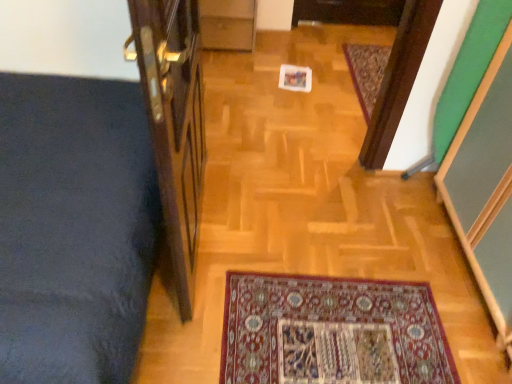
Question: From a real-world perspective, is carpeted mat at center positioned above or below wooden door at left?

Choices:
 (A) below
 (B) above

Answer: (A)

Question: From their relative heights in the image, would you say carpeted mat at center is taller or shorter than wooden door at left?

Choices:
 (A) short
 (B) tall

Answer: (A)

Question: Would you say carpeted mat at center is inside or outside wooden door at left?

Choices:
 (A) outside
 (B) inside

Answer: (A)

Question: Is wooden door at left wider or thinner than carpeted mat at center?

Choices:
 (A) thin
 (B) wide

Answer: (A)

Question: Would you say wooden door at left is inside or outside carpeted mat at center?

Choices:
 (A) inside
 (B) outside

Answer: (B)

Question: Relative to carpeted mat at center, is wooden door at left in front or behind?

Choices:
 (A) behind
 (B) front

Answer: (B)

Question: Is point (197, 188) closer or farther from the camera than point (346, 43)?

Choices:
 (A) closer
 (B) farther

Answer: (A)